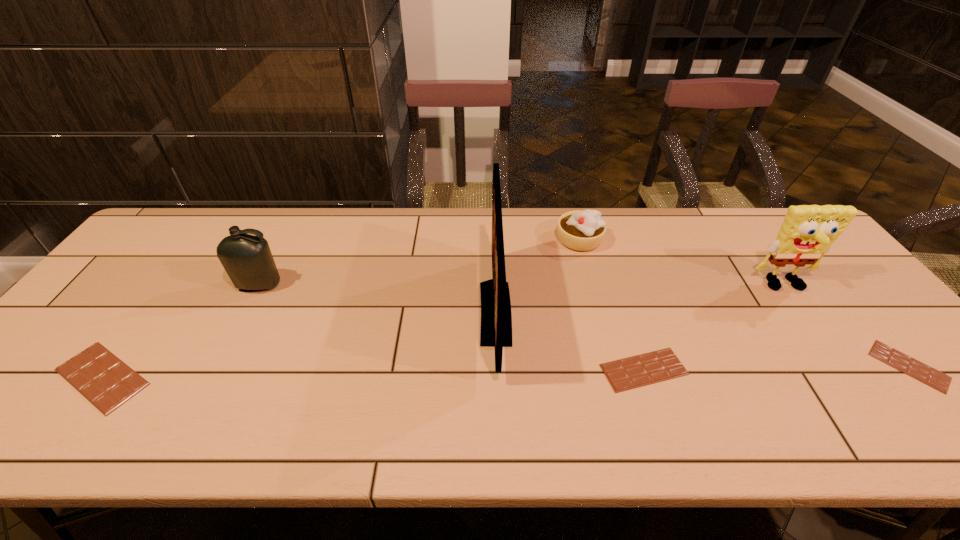
The width and height of the screenshot is (960, 540). I want to click on empty space that is in between the sixth shortest object and the third object from left to right, so click(640, 299).

In order to click on vacant space that is in between the second shortest object and the fourth tallest object in this screenshot , I will do `click(612, 305)`.

Locate an element on the screen. free space between the second shortest chocolate bar and the sixth shortest object is located at coordinates (x=714, y=328).

Locate an element on the screen. Image resolution: width=960 pixels, height=540 pixels. vacant space in between the leftmost object and the fifth shortest object is located at coordinates (180, 331).

Find the location of `free space between the second shortest chocolate bar and the whipped cream`. free space between the second shortest chocolate bar and the whipped cream is located at coordinates (612, 305).

At what (x,y) coordinates should I click in order to perform the action: click on object that is the sixth closest to the sponge. Please return your answer as a coordinate pair (x, y). The height and width of the screenshot is (540, 960). Looking at the image, I should click on (102, 378).

You are a GUI agent. You are given a task and a screenshot of the screen. Output one action in this format:
    pyautogui.click(x=<x>, y=<y>)
    Task: Click on the object that is the closest to the monitor
    
    Given the screenshot: What is the action you would take?
    pyautogui.click(x=581, y=230)

Locate an element on the screen. The image size is (960, 540). the third closest chocolate bar to the sixth shortest object is located at coordinates (102, 378).

Identify the location of chocolate bar that stands as the second closest to the fifth object from right to left. The height and width of the screenshot is (540, 960). (102, 378).

Where is `blank area in the image that satisfies the following two spatial constraints: 1. on the front side of the third tallest object; 2. on the right side of the sixth tallest object`? blank area in the image that satisfies the following two spatial constraints: 1. on the front side of the third tallest object; 2. on the right side of the sixth tallest object is located at coordinates (215, 370).